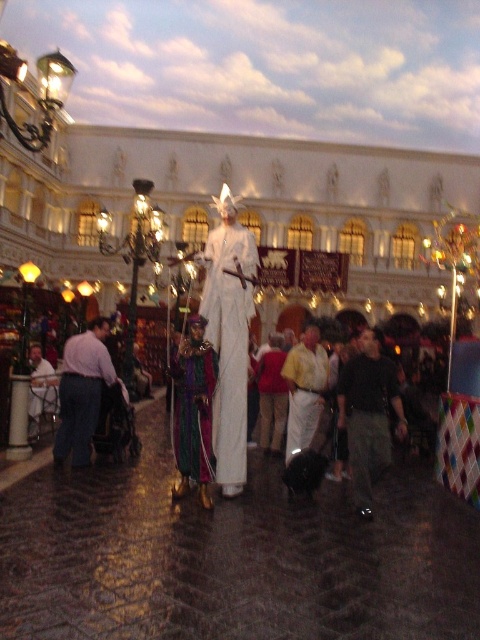
Question: Is white fabric statue at center above multicolored velvet robe at center?

Choices:
 (A) no
 (B) yes

Answer: (B)

Question: Among these objects, which one is nearest to the camera?

Choices:
 (A) white cotton shirt at center
 (B) white fabric statue at center
 (C) light pink shirt at center
 (D) multicolored velvet robe at center

Answer: (D)

Question: Observing the image, what is the correct spatial positioning of white fabric statue at center in reference to light pink shirt at center?

Choices:
 (A) above
 (B) below

Answer: (A)

Question: Which object is the farthest from the light pink shirt at center?

Choices:
 (A) multicolored velvet robe at center
 (B) black cotton pants at center
 (C) white cotton shirt at center

Answer: (B)

Question: Can you confirm if white fabric statue at center is thinner than white cotton shirt at center?

Choices:
 (A) yes
 (B) no

Answer: (B)

Question: Considering the real-world distances, which object is closest to the white fabric statue at center?

Choices:
 (A) light pink shirt at center
 (B) white cotton shirt at center
 (C) multicolored velvet robe at center
 (D) black cotton pants at center

Answer: (C)